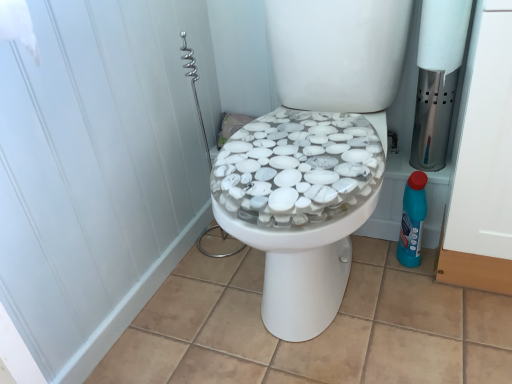
Question: Does blue plastic bottle at right come in front of white matte toilet paper at upper right?

Choices:
 (A) yes
 (B) no

Answer: (B)

Question: Can you confirm if blue plastic bottle at right is bigger than white matte toilet paper at upper right?

Choices:
 (A) yes
 (B) no

Answer: (B)

Question: Can you confirm if blue plastic bottle at right is taller than white matte toilet paper at upper right?

Choices:
 (A) no
 (B) yes

Answer: (A)

Question: Is blue plastic bottle at right turned away from white matte toilet paper at upper right?

Choices:
 (A) no
 (B) yes

Answer: (A)

Question: Can you confirm if blue plastic bottle at right is thinner than white matte toilet paper at upper right?

Choices:
 (A) yes
 (B) no

Answer: (A)

Question: From the image's perspective, is blue plastic bottle at right positioned above or below white matte screen door at upper left?

Choices:
 (A) below
 (B) above

Answer: (A)

Question: Is blue plastic bottle at right bigger or smaller than white matte screen door at upper left?

Choices:
 (A) big
 (B) small

Answer: (B)

Question: Which is correct: blue plastic bottle at right is inside white matte screen door at upper left, or outside of it?

Choices:
 (A) inside
 (B) outside

Answer: (B)

Question: Relative to white matte screen door at upper left, is blue plastic bottle at right in front or behind?

Choices:
 (A) behind
 (B) front

Answer: (A)

Question: In terms of height, does blue plastic bottle at right look taller or shorter compared to white matte toilet paper at upper right?

Choices:
 (A) short
 (B) tall

Answer: (A)

Question: From the image's perspective, is blue plastic bottle at right positioned above or below white matte toilet paper at upper right?

Choices:
 (A) above
 (B) below

Answer: (B)

Question: Is blue plastic bottle at right inside the boundaries of white matte toilet paper at upper right, or outside?

Choices:
 (A) outside
 (B) inside

Answer: (A)

Question: Considering the relative positions of blue plastic bottle at right and white matte toilet paper at upper right in the image provided, is blue plastic bottle at right to the left or to the right of white matte toilet paper at upper right?

Choices:
 (A) left
 (B) right

Answer: (A)

Question: Is white matte toilet paper at upper right inside the boundaries of white matte screen door at upper left, or outside?

Choices:
 (A) inside
 (B) outside

Answer: (B)

Question: Based on their positions, is white matte toilet paper at upper right located to the left or right of white matte screen door at upper left?

Choices:
 (A) left
 (B) right

Answer: (B)